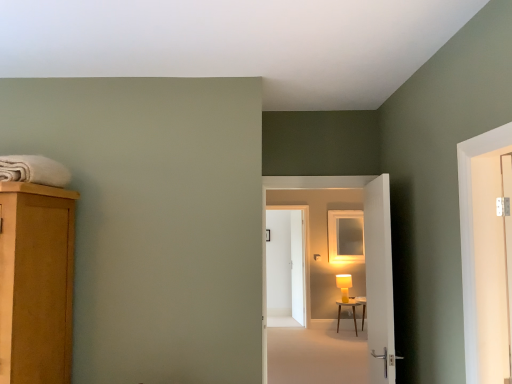
Question: Is white glossy screen door at right, which appears as the second screen door when viewed from the back, touching white glossy door at center-right, the third door from the back?

Choices:
 (A) no
 (B) yes

Answer: (A)

Question: Considering the relative sizes of white glossy screen door at right, which ranks as the first screen door in right-to-left order, and white glossy door at center-right, which ranks as the 1th door in front-to-back order, in the image provided, is white glossy screen door at right, which ranks as the first screen door in right-to-left order, smaller than white glossy door at center-right, which ranks as the 1th door in front-to-back order,?

Choices:
 (A) yes
 (B) no

Answer: (A)

Question: Is white glossy screen door at right, which ranks as the first screen door in right-to-left order, further to camera compared to white glossy door at center-right, the third door from the back?

Choices:
 (A) yes
 (B) no

Answer: (B)

Question: Is the depth of white glossy screen door at right, which is the 2th screen door from left to right, less than that of white glossy door at center-right, the third door from the back?

Choices:
 (A) no
 (B) yes

Answer: (B)

Question: Is white glossy screen door at right, which is the 1th screen door from front to back, aimed at white glossy door at center-right, which ranks as the 1th door in front-to-back order?

Choices:
 (A) no
 (B) yes

Answer: (A)

Question: Is white glossy door at center-right, which ranks as the 1th door in front-to-back order, inside white glossy screen door at right, which ranks as the first screen door in right-to-left order?

Choices:
 (A) yes
 (B) no

Answer: (B)

Question: Does white glossy door at center-right, which ranks as the 1th door in front-to-back order, have a smaller size compared to matte white medicine cabinet at center?

Choices:
 (A) yes
 (B) no

Answer: (B)

Question: Is white glossy door at center-right, the third door from the back, positioned in front of matte white medicine cabinet at center?

Choices:
 (A) no
 (B) yes

Answer: (B)

Question: From the image's perspective, is white glossy door at center-right, the third door from the back, beneath matte white medicine cabinet at center?

Choices:
 (A) yes
 (B) no

Answer: (B)

Question: Is white glossy door at center-right, the third door from the back, taller than matte white medicine cabinet at center?

Choices:
 (A) no
 (B) yes

Answer: (B)

Question: Is white glossy door at center-right, which ranks as the 1th door in front-to-back order, turned away from matte white medicine cabinet at center?

Choices:
 (A) no
 (B) yes

Answer: (A)

Question: From a real-world perspective, is white glossy door at center-right, which ranks as the 1th door in front-to-back order, below matte white medicine cabinet at center?

Choices:
 (A) no
 (B) yes

Answer: (B)

Question: Is white soft towel at upper left far from wooden side table at center?

Choices:
 (A) no
 (B) yes

Answer: (B)